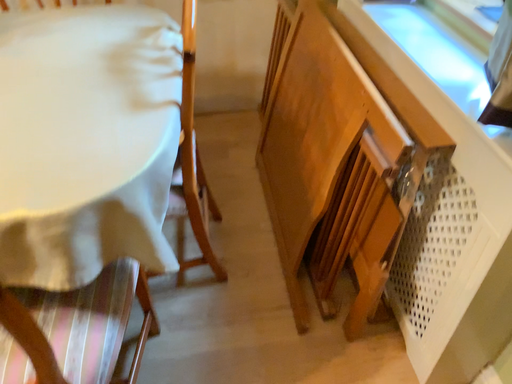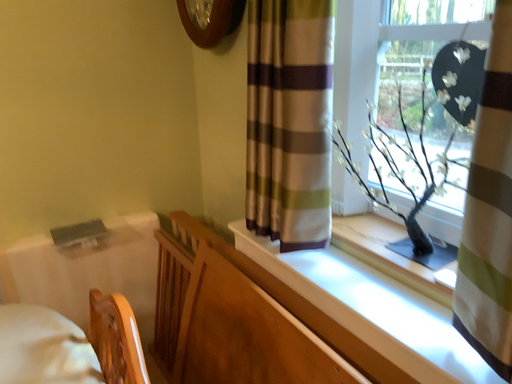
Question: How did the camera likely rotate when shooting the video?

Choices:
 (A) rotated right
 (B) rotated left

Answer: (A)